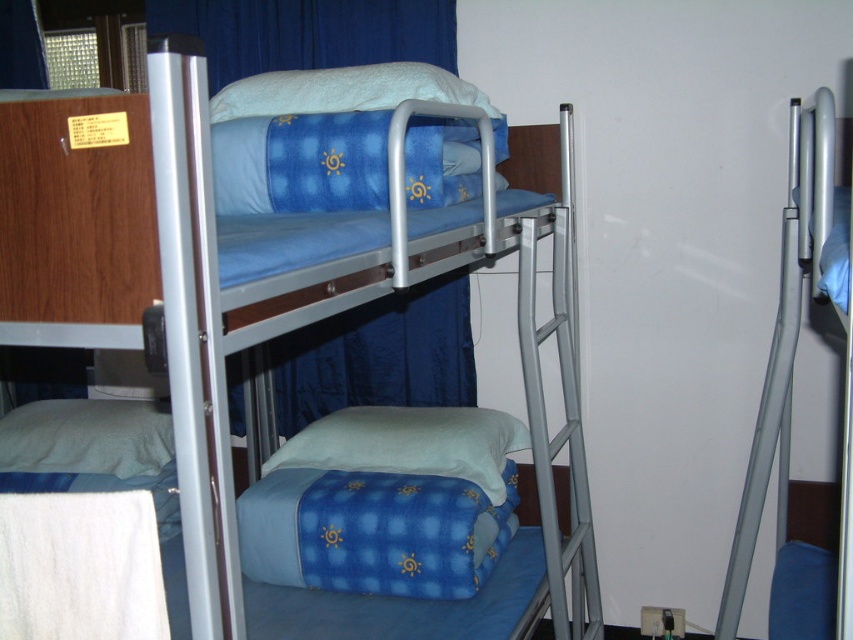
Question: Among these objects, which one is nearest to the camera?

Choices:
 (A) blue fabric curtain at upper center
 (B) blue fabric curtain at center
 (C) soft blue fabric pillow at center

Answer: (C)

Question: Considering the real-world distances, which object is closest to the blue fabric curtain at upper center?

Choices:
 (A) blue fabric curtain at center
 (B) soft blue fabric pillow at center

Answer: (A)

Question: Can you confirm if blue fabric bunk bed at upper center is wider than white soft pillow at upper center?

Choices:
 (A) no
 (B) yes

Answer: (B)

Question: Is soft blue fabric pillow at center smaller than white soft pillow at lower left?

Choices:
 (A) no
 (B) yes

Answer: (A)

Question: Which object appears closest to the camera in this image?

Choices:
 (A) blue fabric bunk bed at upper center
 (B) soft blue fabric pillow at center
 (C) blue fabric curtain at upper center
 (D) white soft pillow at upper center

Answer: (A)

Question: Can you confirm if blue fabric bunk bed at upper center is positioned to the right of blue fabric curtain at upper center?

Choices:
 (A) yes
 (B) no

Answer: (A)